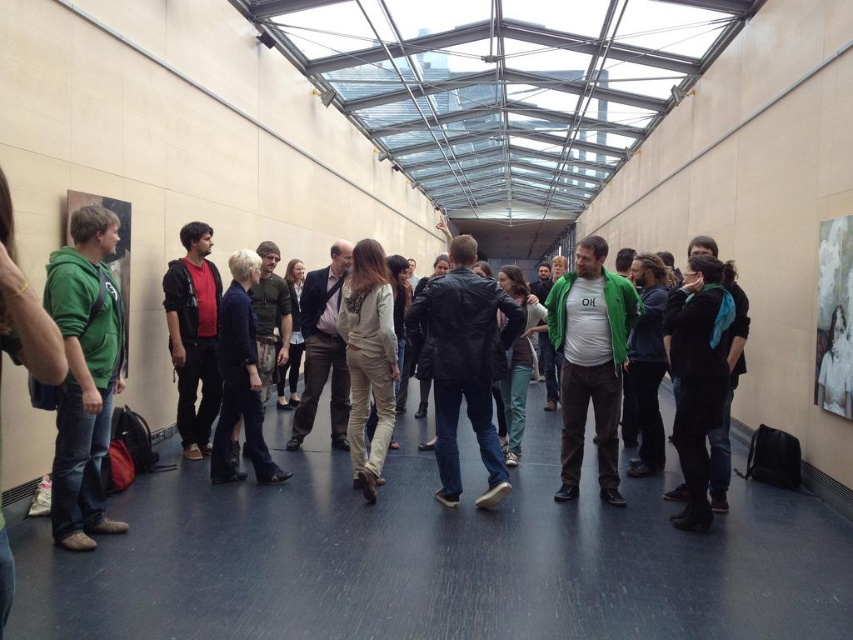
You are a photographer setting up a shoot in the corridor. You need to place a backdrop behind the two subjects wearing the leather jacket at center and the dark red hoodie at center. Since the backdrop needs to cover both subjects fully, which subject requires a larger portion of the backdrop to be allocated to them?

The leather jacket at center requires a larger portion of the backdrop because it is larger in size than the dark red hoodie at center.

You are standing in the corridor and need to find the green fleece jacket at left. According to the coordinates provided, where exactly is it positioned?

The green fleece jacket at left is located at point 0.586 along the horizontal axis and 0.100 along the vertical axis.

You are at a social gathering in the corridor and want to borrow a jacket from either the green fleece jacket at left or the leather jacket at center. If you are standing between them, which jacket is closer to you?

The green fleece jacket at left is closer to you since it is positioned to the left of the leather jacket at center, meaning you are between them with the green fleece jacket at left nearest to your current position.